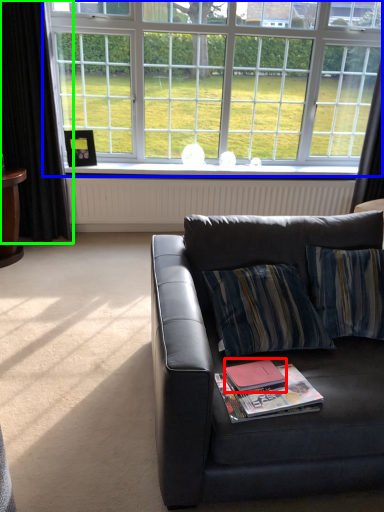
Question: Which is nearer to the paperback book (highlighted by a red box)? window (highlighted by a blue box) or curtain (highlighted by a green box).

Choices:
 (A) window
 (B) curtain

Answer: (B)